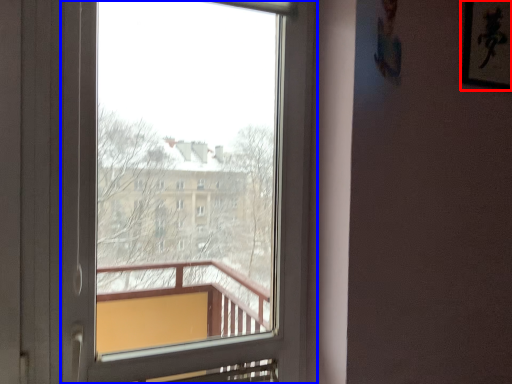
Question: Among these objects, which one is farthest to the camera, picture frame (highlighted by a red box) or window (highlighted by a blue box)?

Choices:
 (A) picture frame
 (B) window

Answer: (A)